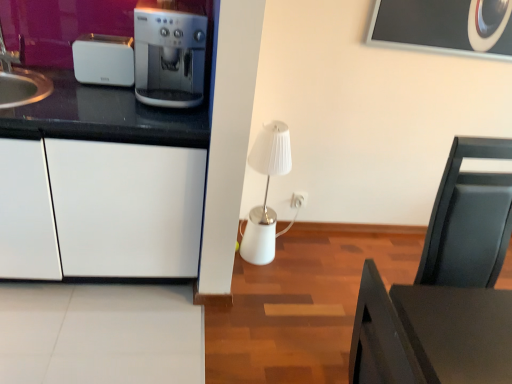
What is the approximate height of white plastic toaster at left?

The height of white plastic toaster at left is 8.08 inches.

Measure the distance between point (88,78) and camera.

Point (88,78) and camera are 1.86 meters apart.

The width and height of the screenshot is (512, 384). What do you see at coordinates (430, 334) in the screenshot?
I see `black matte table at lower right` at bounding box center [430, 334].

What is the approximate width of satin silver coffee machine at left?

The width of satin silver coffee machine at left is 34.24 centimeters.

Find the location of a particular element. The width and height of the screenshot is (512, 384). white plastic toaster at left is located at coordinates (104, 60).

From a real-world perspective, does white plastic electric outlet at center-right stand above white plastic toaster at left?

No, from a real-world perspective, white plastic electric outlet at center-right is not over white plastic toaster at left

Is white plastic electric outlet at center-right shorter than white plastic toaster at left?

Yes.

Looking at this image, between white plastic electric outlet at center-right and white plastic toaster at left, which one has larger size?

white plastic toaster at left.

Which object is positioned more to the left, black matte table at lower right or satin silver coffee machine at left?

satin silver coffee machine at left.

Is black matte table at lower right outside of satin silver coffee machine at left?

Yes, black matte table at lower right is located beyond the bounds of satin silver coffee machine at left.

What's the angular difference between black matte table at lower right and satin silver coffee machine at left's facing directions?

92.6 degrees.

From the image's perspective, between black matte table at lower right and satin silver coffee machine at left, which one is located above?

From the image's view, satin silver coffee machine at left is above.

Between white plastic toaster at left and white plastic electric outlet at center-right, which one has smaller width?

With smaller width is white plastic electric outlet at center-right.

The height and width of the screenshot is (384, 512). In order to click on electric outlet behind the white plastic toaster at left in this screenshot , I will do `click(298, 199)`.

Which is more to the right, white plastic toaster at left or white plastic electric outlet at center-right?

white plastic electric outlet at center-right is more to the right.

From the picture: Looking at their sizes, would you say black matte table at lower right is wider or thinner than white plastic toaster at left?

black matte table at lower right is wider than white plastic toaster at left.

Identify the location of table that appears below the white plastic toaster at left (from the image's perspective). (430, 334).

How different are the orientations of black matte table at lower right and white plastic toaster at left in degrees?

There is a 93.8-degree angle between the facing directions of black matte table at lower right and white plastic toaster at left.

Is the depth of black matte table at lower right less than that of white plastic toaster at left?

Yes, black matte table at lower right is in front of white plastic toaster at left.

Is black matte table at lower right not close to white plastic electric outlet at center-right?

That's right, there is a large distance between black matte table at lower right and white plastic electric outlet at center-right.

From a real-world perspective, is black matte table at lower right under white plastic electric outlet at center-right?

No, from a real-world perspective, black matte table at lower right is not below white plastic electric outlet at center-right.

Does black matte table at lower right have a larger size compared to white plastic electric outlet at center-right?

Correct, black matte table at lower right is larger in size than white plastic electric outlet at center-right.

In the image, is black matte table at lower right on the left side or the right side of white plastic electric outlet at center-right?

Based on their positions, black matte table at lower right is located to the right of white plastic electric outlet at center-right.

Is satin silver coffee machine at left beside white plastic toaster at left?

They are not placed beside each other.

Can you confirm if satin silver coffee machine at left is taller than white plastic toaster at left?

Yes.

From the image's perspective, between satin silver coffee machine at left and white plastic toaster at left, which one is located above?

white plastic toaster at left is shown above in the image.

How different are the orientations of satin silver coffee machine at left and white plastic toaster at left in degrees?

satin silver coffee machine at left and white plastic toaster at left are facing 1.21 degrees away from each other.

Consider the image. In the image, is black matte table at lower right positioned in front of or behind white glossy cabinet at left?

Visually, black matte table at lower right is located in front of white glossy cabinet at left.

Is white glossy cabinet at left inside black matte table at lower right?

No, black matte table at lower right does not contain white glossy cabinet at left.

From a real-world perspective, between black matte table at lower right and white glossy cabinet at left, who is vertically higher?

black matte table at lower right is physically above.

Is point (450, 333) positioned before point (194, 138)?

Yes, it is.

Locate an element on the screen. electric outlet on the right of white plastic toaster at left is located at coordinates (298, 199).

Locate an element on the screen. table below the satin silver coffee machine at left (from the image's perspective) is located at coordinates (430, 334).

From the image, which object appears to be nearer to white glossy cabinet at left, white plastic toaster at left or satin silver coffee machine at left?

satin silver coffee machine at left is closer to white glossy cabinet at left.

From the image, which object appears to be nearer to white plastic electric outlet at center-right, satin silver coffee machine at left or black matte table at lower right?

Based on the image, satin silver coffee machine at left appears to be nearer to white plastic electric outlet at center-right.

From the image, which object appears to be farther from white plastic electric outlet at center-right, satin silver coffee machine at left or white glossy cabinet at left?

Based on the image, white glossy cabinet at left appears to be further to white plastic electric outlet at center-right.

Considering their positions, is black matte table at lower right positioned closer to white glossy cabinet at left than satin silver coffee machine at left?

satin silver coffee machine at left is positioned closer to the anchor white glossy cabinet at left.

Looking at the image, which one is located further to black matte table at lower right, white glossy cabinet at left or white plastic toaster at left?

white plastic toaster at left is positioned further to the anchor black matte table at lower right.

Based on their spatial positions, is white plastic toaster at left or white plastic electric outlet at center-right further from satin silver coffee machine at left?

white plastic electric outlet at center-right lies further to satin silver coffee machine at left than the other object.

Which object lies nearer to the anchor point satin silver coffee machine at left, white glossy cabinet at left or white plastic toaster at left?

Among the two, white plastic toaster at left is located nearer to satin silver coffee machine at left.

When comparing their distances from black matte table at lower right, does white plastic electric outlet at center-right or white plastic toaster at left seem closer?

white plastic toaster at left is closer to black matte table at lower right.

The height and width of the screenshot is (384, 512). In order to click on kitchen appliance situated between white glossy cabinet at left and white plastic electric outlet at center-right from left to right in this screenshot , I will do `click(104, 60)`.

The height and width of the screenshot is (384, 512). Identify the location of home appliance between white glossy cabinet at left and black matte table at lower right from left to right. (169, 53).

Find the location of a particular element. This screenshot has height=384, width=512. home appliance between white glossy cabinet at left and white plastic electric outlet at center-right in the front-back direction is located at coordinates (169, 53).

This screenshot has width=512, height=384. In order to click on kitchen appliance between white glossy cabinet at left and black matte table at lower right in the horizontal direction in this screenshot , I will do `click(104, 60)`.